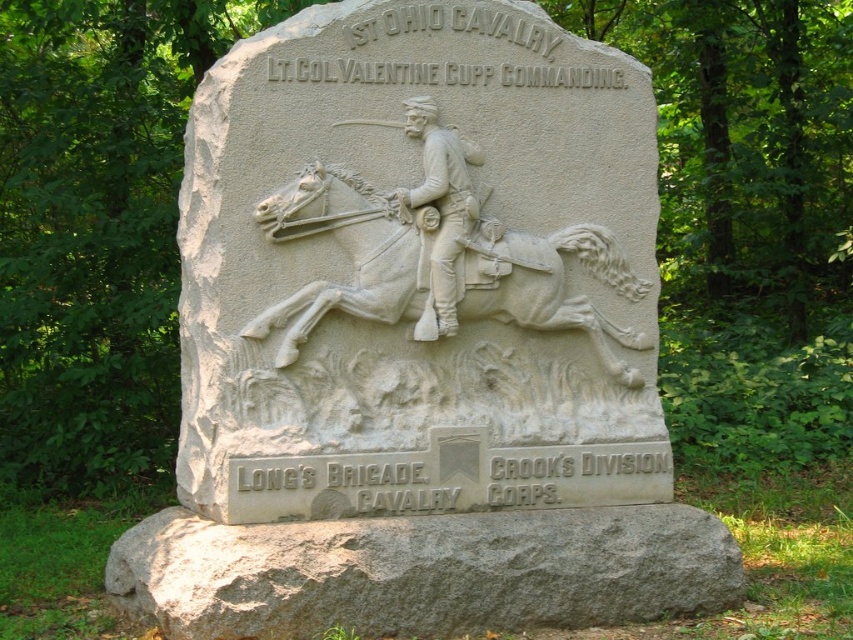
You are a tour guide explaining the monument to visitors. You want to mention the relative sizes of the gray stone base at lower center and the white stone soldier at center. What can you tell them about their widths?

The gray stone base at lower center is wider than the white stone soldier at center.

You are a tourist standing in front of the historical monument. You notice the white stone horse at center and the white stone soldier at center. Which one appears closer to you?

The white stone horse at center is in front of the white stone soldier at center, so the horse appears closer to you.

You are a tourist standing in front of the historical monument. You notice the gray stone base at lower center and the white stone horse at center. Which object is supporting the other?

The gray stone base at lower center is positioned under the white stone horse at center, so the gray stone base at lower center is supporting the white stone horse at center.